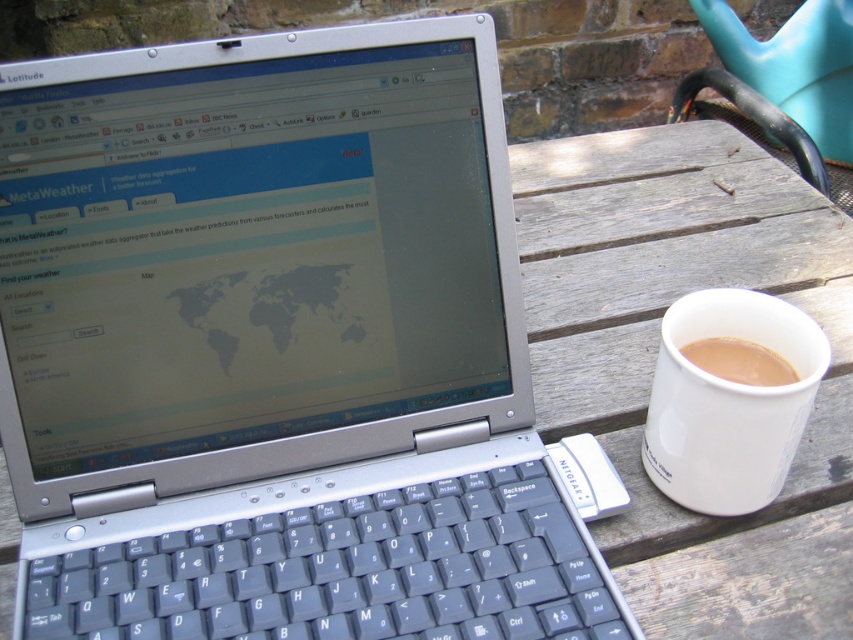
Question: Where is silver metallic laptop at center located in relation to white ceramic mug at right in the image?

Choices:
 (A) below
 (B) above

Answer: (B)

Question: Is the position of silver metallic laptop at center less distant than that of white matte cup at right?

Choices:
 (A) no
 (B) yes

Answer: (B)

Question: Which object is farther from the camera taking this photo?

Choices:
 (A) white ceramic mug at right
 (B) silver metallic laptop at center
 (C) white matte cup at right

Answer: (C)

Question: Can you confirm if silver metallic laptop at center is bigger than white matte cup at right?

Choices:
 (A) yes
 (B) no

Answer: (A)

Question: Considering the real-world distances, which object is farthest from the white ceramic mug at right?

Choices:
 (A) silver metallic laptop at center
 (B) white matte cup at right

Answer: (A)

Question: Considering the real-world distances, which object is closest to the silver metallic laptop at center?

Choices:
 (A) white matte cup at right
 (B) white ceramic mug at right

Answer: (B)